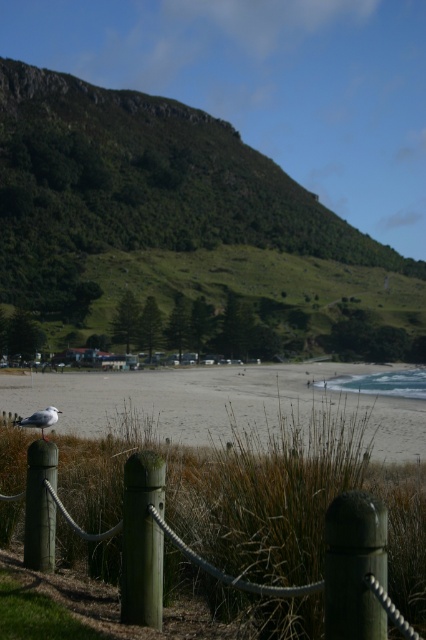
You are standing at the edge of the beach and see the green wood fence at lower center and the green matte post at lower left. Which object is closer to you?

The green wood fence at lower center is closer to you because it is in front of the green matte post at lower left.